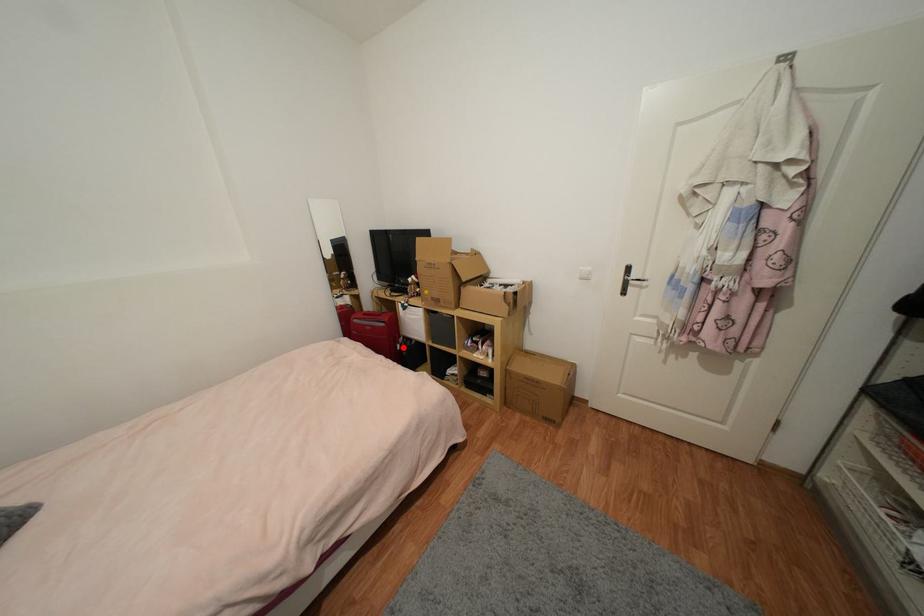
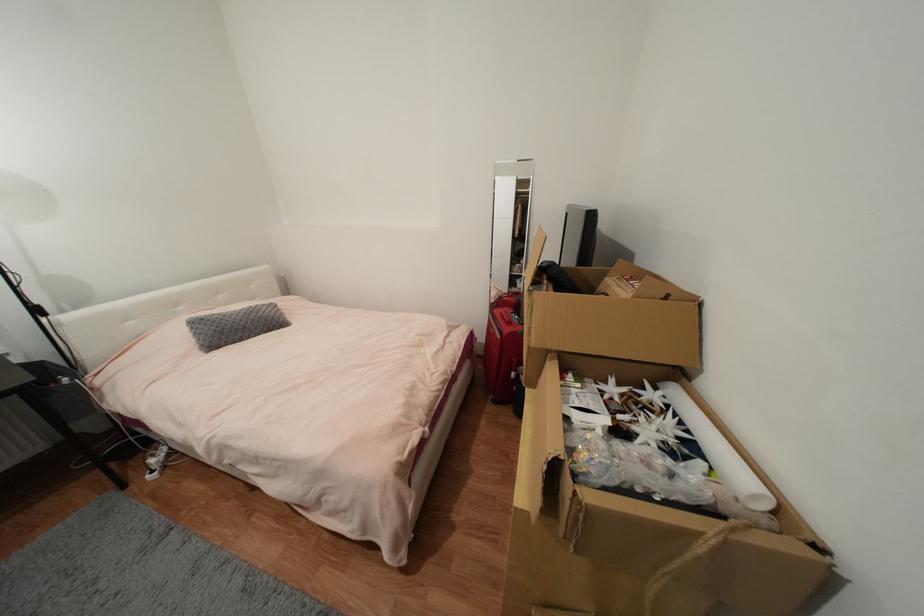
Where in the second image is the point corresponding to the highlighted location from the first image?

(517, 375)